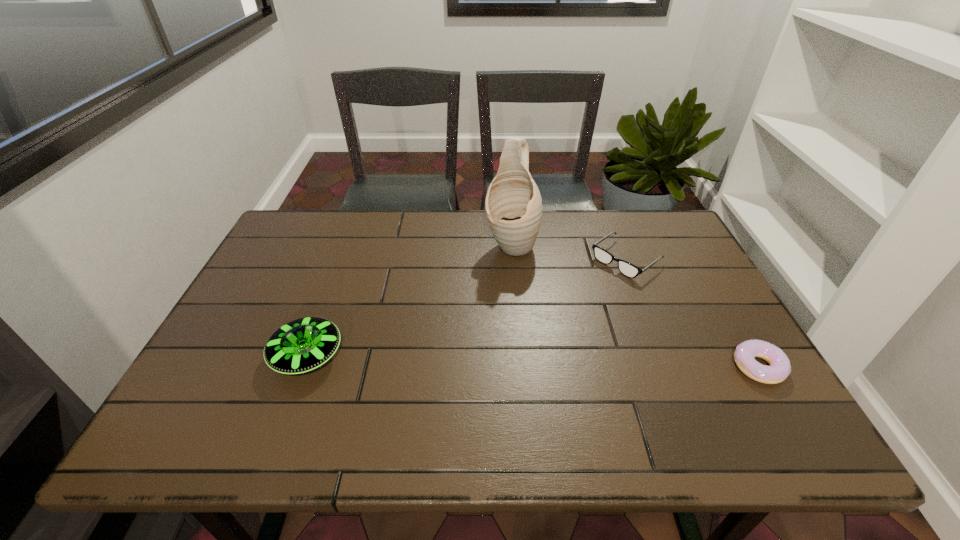
The width and height of the screenshot is (960, 540). Identify the location of the second tallest object. (302, 345).

The height and width of the screenshot is (540, 960). What are the coordinates of `the leftmost object` in the screenshot? It's located at (302, 345).

Where is `the rightmost object`? The width and height of the screenshot is (960, 540). the rightmost object is located at coordinates (745, 353).

Locate an element on the screen. The image size is (960, 540). the second object from right to left is located at coordinates (629, 270).

Identify the location of the third object from right to left. The width and height of the screenshot is (960, 540). (513, 204).

Where is `the tallest object`? The image size is (960, 540). the tallest object is located at coordinates (513, 204).

This screenshot has width=960, height=540. Identify the location of free region located 0.070m on the right of the third shortest object. (372, 356).

Locate an element on the screen. Image resolution: width=960 pixels, height=540 pixels. vacant region located on the left of the rightmost object is located at coordinates (672, 367).

The width and height of the screenshot is (960, 540). Identify the location of vacant area situated on the front-facing side of the spectacles. (509, 349).

Find the location of a particular element. The height and width of the screenshot is (540, 960). vacant space positioned 0.170m on the front-facing side of the spectacles is located at coordinates (568, 303).